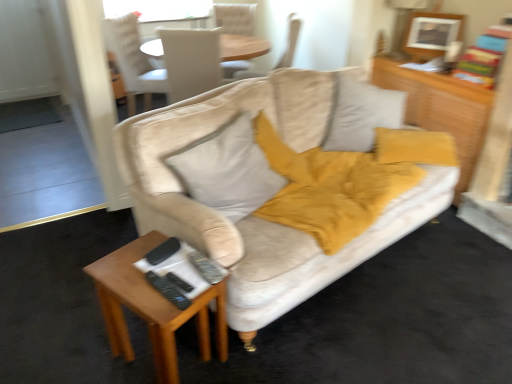
Locate an element on the screen. blank space situated above wooden rectangular table at lower left (from a real-world perspective) is located at coordinates (158, 268).